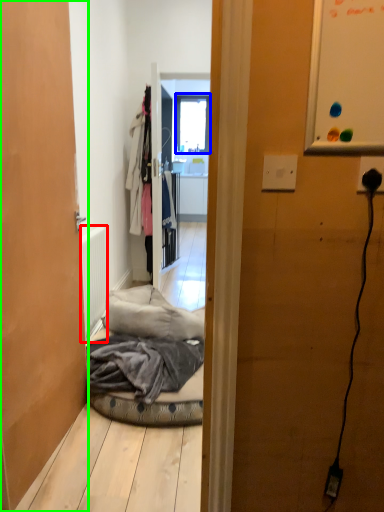
Question: Considering the real-world distances, which object is closest to radiator (highlighted by a red box)? window (highlighted by a blue box) or door (highlighted by a green box).

Choices:
 (A) window
 (B) door

Answer: (B)